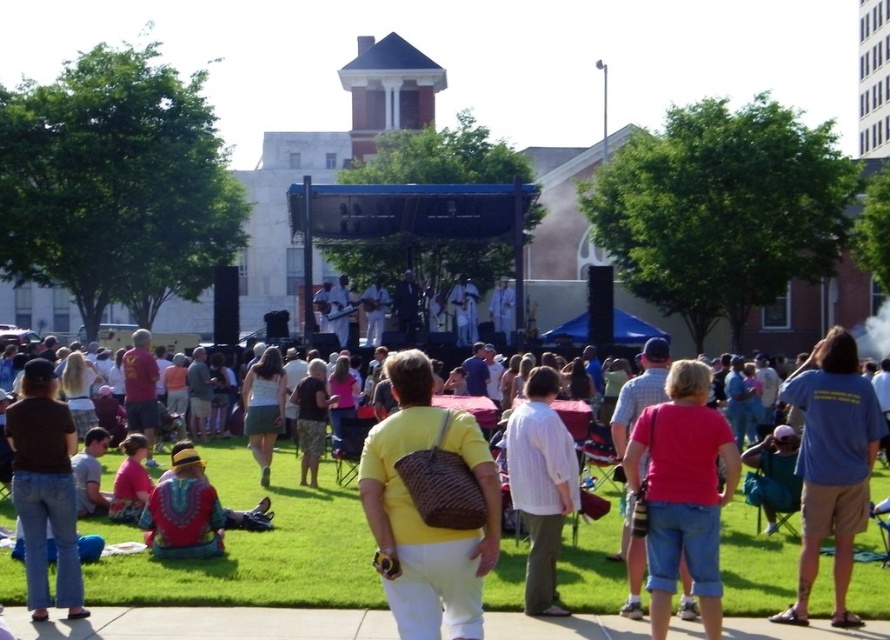
Question: Which point is closer to the camera?

Choices:
 (A) pink fabric shirt at center
 (B) matte green skirt at center
 (C) white striped shirt at center

Answer: (A)

Question: Does pink fabric shirt at center appear on the right side of blue cotton shirt at right?

Choices:
 (A) yes
 (B) no

Answer: (B)

Question: Is the position of blue cotton shirt at right less distant than that of matte green skirt at center?

Choices:
 (A) yes
 (B) no

Answer: (A)

Question: Among these points, which one is farthest from the camera?

Choices:
 (A) (856, 451)
 (B) (268, 464)

Answer: (B)

Question: Where is yellow woven bag at center located in relation to white striped shirt at center in the image?

Choices:
 (A) left
 (B) right

Answer: (A)

Question: Which point is closer to the camera?

Choices:
 (A) (653, 422)
 (B) (46, 460)
 (C) (555, 536)

Answer: (A)